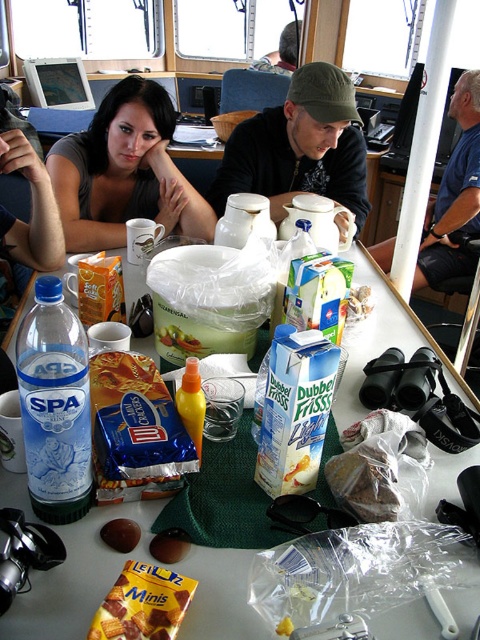
You are standing in the ship cabin and want to reach the point at coordinates (22, 337). Is this point within your immediate reach without moving your feet?

The point at coordinates (22, 337) is 30.85 inches from the camera, so it is within immediate reach without moving your feet.

What is located at the coordinates point (55, 404)?

The coordinates point (55, 404) indicate the location of the matte plastic bottle at center left.

You are standing in the ship cabin and need to place a new item on the table. According to the coordinates provided, where exactly should you place the item on the white plastic table at center?

The white plastic table at center is located at coordinates point (76, 577), so you should place the new item at that position.